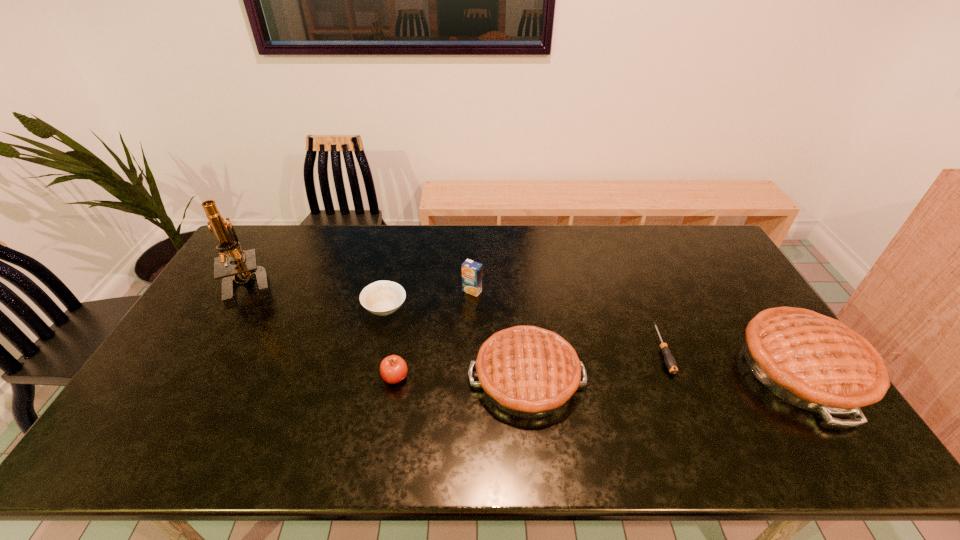
The width and height of the screenshot is (960, 540). I want to click on free space that satisfies the following two spatial constraints: 1. at the eyepiece of the orange_juice; 2. on the right side of the leftmost object, so click(x=246, y=291).

Where is `vacant space that satisfies the following two spatial constraints: 1. at the eyepiece of the tallest object; 2. on the left side of the screwdriver`? The image size is (960, 540). vacant space that satisfies the following two spatial constraints: 1. at the eyepiece of the tallest object; 2. on the left side of the screwdriver is located at coordinates (211, 350).

Where is `vacant space that satisfies the following two spatial constraints: 1. on the front side of the right pie; 2. on the left side of the sixth tallest object`? vacant space that satisfies the following two spatial constraints: 1. on the front side of the right pie; 2. on the left side of the sixth tallest object is located at coordinates (372, 369).